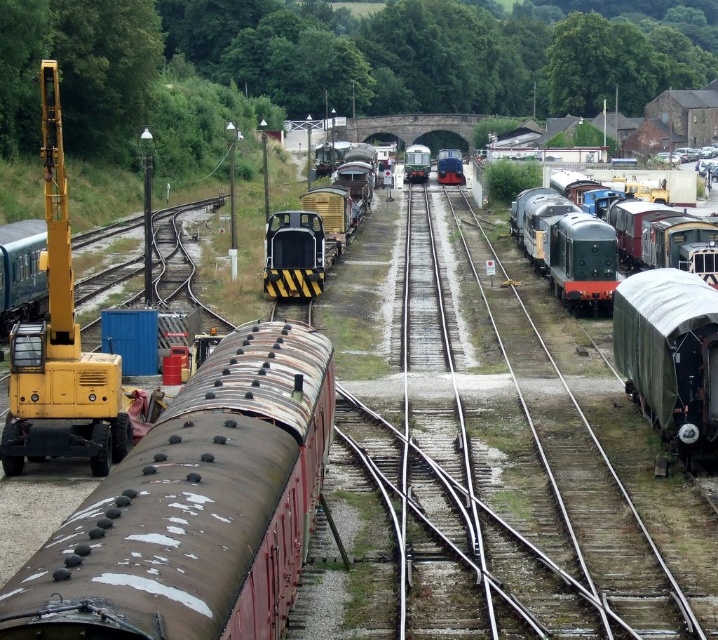
Question: Which point is closer to the camera?

Choices:
 (A) smooth metal tracks at center
 (B) black textured train car at center
 (C) green canvas train car at right
 (D) rusty metal train car at lower left

Answer: (D)

Question: Is smooth metal tracks at center above black textured train car at center?

Choices:
 (A) no
 (B) yes

Answer: (A)

Question: Does black textured locomotive at center have a larger size compared to green polished wood train at center?

Choices:
 (A) no
 (B) yes

Answer: (B)

Question: Which of the following is the closest to the observer?

Choices:
 (A) black textured train car at center
 (B) green matte train at right

Answer: (B)

Question: Estimate the real-world distances between objects in this image. Which object is farther from the black textured train car at center?

Choices:
 (A) green polished wood train at center
 (B) black textured locomotive at center

Answer: (A)

Question: Is rusty metal train car at lower left in front of polished dark blue locomotive at center?

Choices:
 (A) no
 (B) yes

Answer: (B)